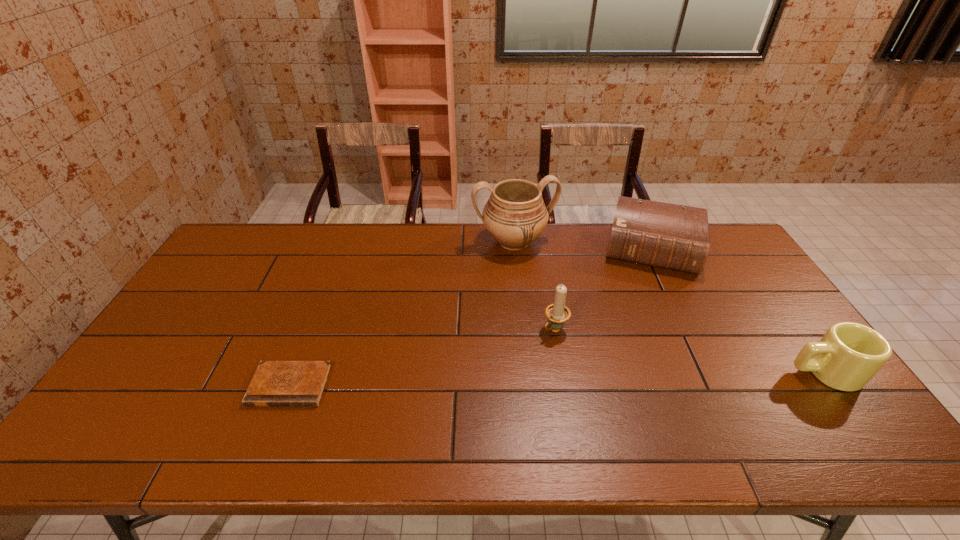
What are the coordinates of `vacant space on the desktop that is between the leftmost object and the mug and is positioned on the front-facing side of the urn` in the screenshot? It's located at (571, 379).

The width and height of the screenshot is (960, 540). I want to click on free spot on the desktop that is between the shortest object and the rightmost object and is positioned on the handle side of the third nearest object, so click(x=497, y=380).

This screenshot has width=960, height=540. Find the location of `free space on the desktop that is between the shortest object and the mug and is positioned on the spine side of the second object from right to left`. free space on the desktop that is between the shortest object and the mug and is positioned on the spine side of the second object from right to left is located at coordinates (640, 377).